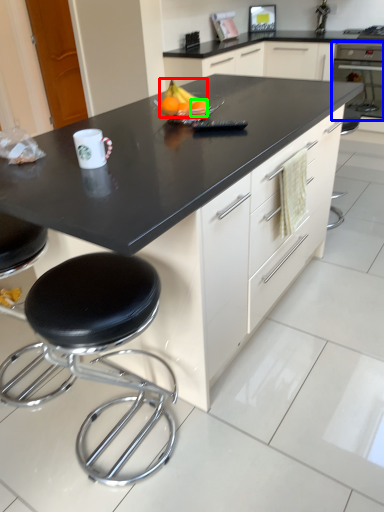
Question: Based on their relative distances, which object is nearer to fruit (highlighted by a red box)? Choose from oven (highlighted by a blue box) and orange (highlighted by a green box).

Choices:
 (A) oven
 (B) orange

Answer: (B)